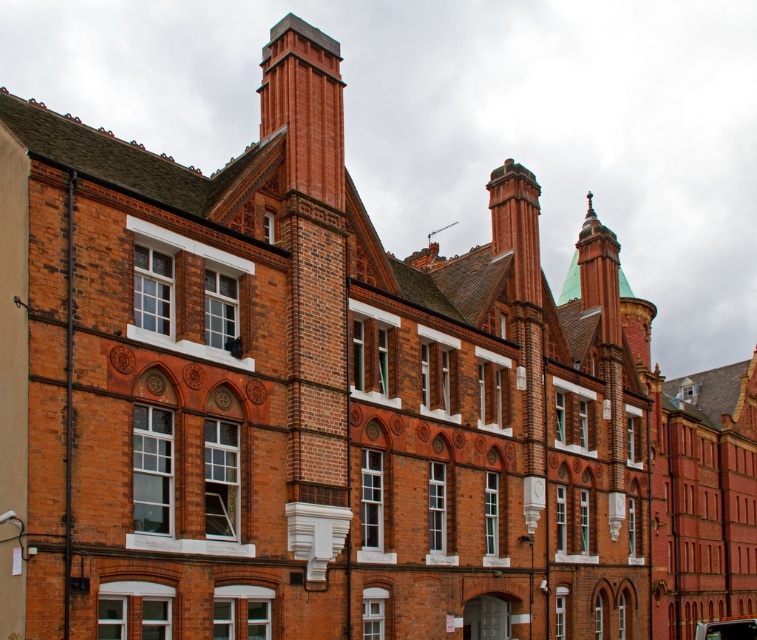
Question: Which object is positioned closest to the shiny black car at bottom right?

Choices:
 (A) brick chimney at upper center
 (B) red brick chimney at upper center

Answer: (B)

Question: Is brick chimney at upper center to the left of shiny black car at bottom right from the viewer's perspective?

Choices:
 (A) yes
 (B) no

Answer: (A)

Question: Estimate the real-world distances between objects in this image. Which object is farther from the red brick chimney at upper center?

Choices:
 (A) shiny black car at bottom right
 (B) brick chimney at upper center

Answer: (A)

Question: Which point is closer to the camera taking this photo?

Choices:
 (A) (715, 621)
 (B) (528, 170)

Answer: (B)

Question: Is brick chimney at upper center positioned at the back of red brick chimney at upper center?

Choices:
 (A) no
 (B) yes

Answer: (A)

Question: Can you confirm if red brick chimney at upper center is thinner than shiny black car at bottom right?

Choices:
 (A) yes
 (B) no

Answer: (A)